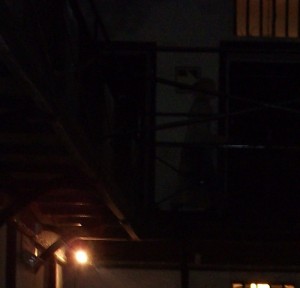
Find the location of a particular element. wall is located at coordinates (195, 30), (136, 283).